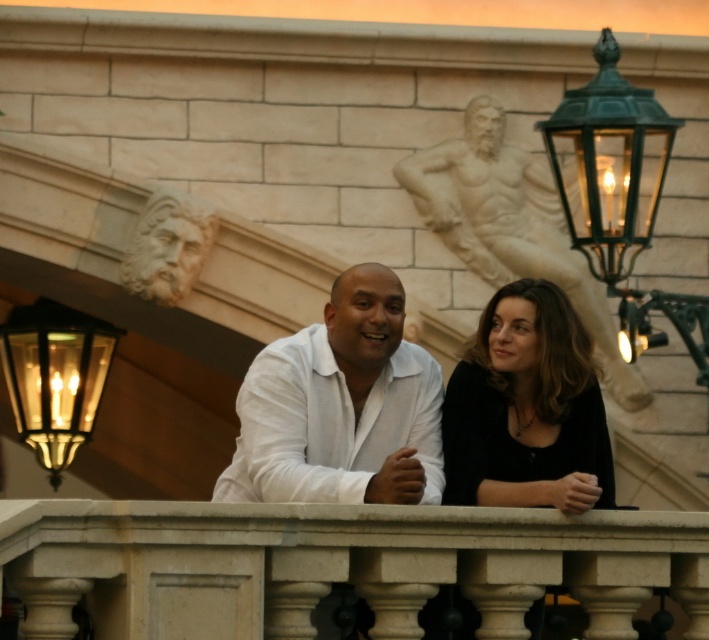
You are standing on the balcony and want to reach the green glass lantern at upper right. Given that the distance from you to the lantern is 67.01 meters, can you comfortably walk to it without any equipment?

The green glass lantern at upper right is 67.01 meters away from the camera, which is too far to comfortably walk to without any equipment.

You are a painter who needs to place a small easel between the white marble balustrade at center and the white matte shirt at center. Based on their widths, which object should the easel be closer to?

The white marble balustrade at center is wider than the white matte shirt at center, so the easel should be placed closer to the white marble balustrade at center to ensure stability and balance.

You are an interior designer planning to place a new decorative item between the green glass lantern at upper right and the white stone statue at upper center. Based on their sizes, which object should the new item be placed closer to?

The green glass lantern at upper right has a lesser width compared to the white stone statue at upper center, so the new item should be placed closer to the white stone statue at upper center to maintain balance.